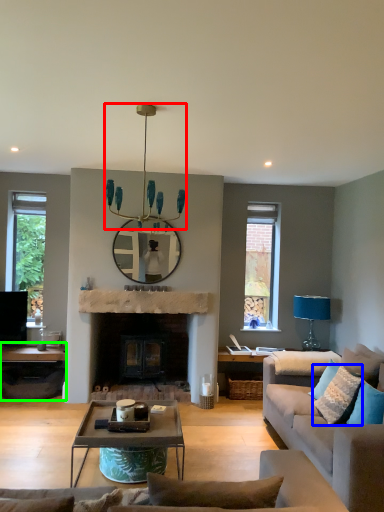
Question: Based on their relative distances, which object is nearer to light fixture (highlighted by a red box)? Choose from pillow (highlighted by a blue box) and table (highlighted by a green box).

Choices:
 (A) pillow
 (B) table

Answer: (B)